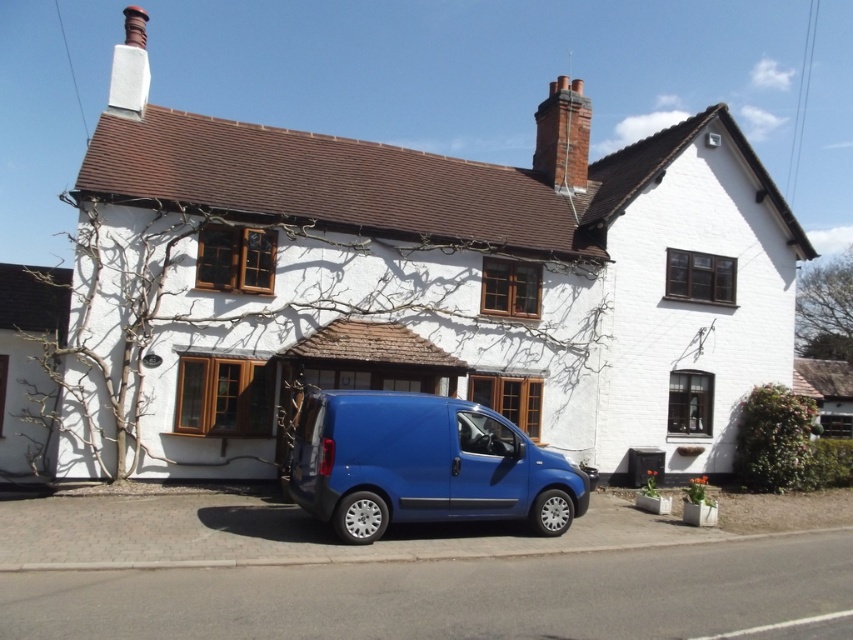
Question: Which point appears farthest from the camera in this image?

Choices:
 (A) (579, 122)
 (B) (837, 412)
 (C) (421, 426)
 (D) (122, 65)

Answer: (B)

Question: Which of the following is the closest to the observer?

Choices:
 (A) (527, 468)
 (B) (10, 312)
 (C) (660, 428)
 (D) (842, 365)

Answer: (A)

Question: Is white painted brick cottage at center wider than red brick chimney at upper right?

Choices:
 (A) no
 (B) yes

Answer: (A)

Question: Estimate the real-world distances between objects in this image. Which object is closer to the white painted wood cottage at lower right?

Choices:
 (A) white painted wood at left
 (B) blue matte van at center
 (C) white painted brick cottage at center

Answer: (C)

Question: From the image, what is the correct spatial relationship of white painted brick cottage at center in relation to red brick chimney at upper right?

Choices:
 (A) below
 (B) above

Answer: (A)

Question: Does white painted wood at left appear on the right side of white painted wood cottage at lower right?

Choices:
 (A) yes
 (B) no

Answer: (B)